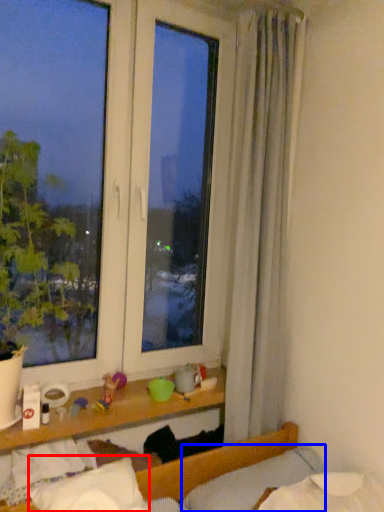
Question: Which point is further to the camera, pillow (highlighted by a red box) or pillow (highlighted by a blue box)?

Choices:
 (A) pillow
 (B) pillow

Answer: (B)